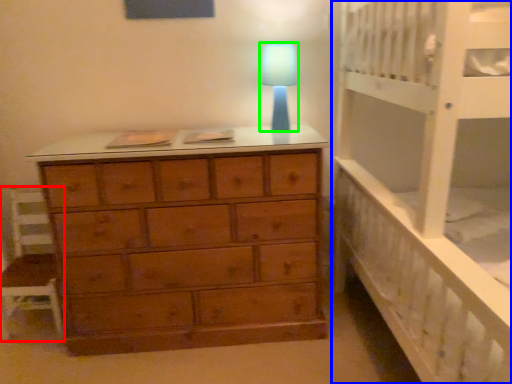
Question: Which object is positioned closest to chair (highlighted by a red box)? Select from bed (highlighted by a blue box) and lamp (highlighted by a green box).

Choices:
 (A) bed
 (B) lamp

Answer: (B)